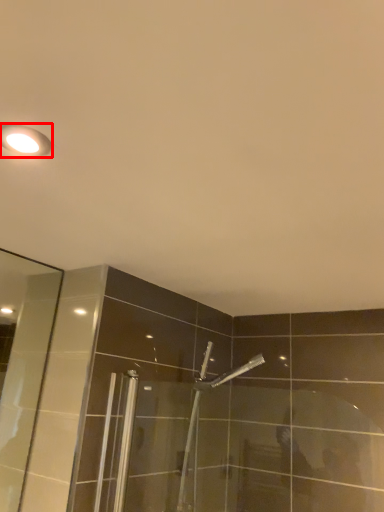
Question: Where is light fixture (annotated by the red box) located in relation to shower in the image?

Choices:
 (A) right
 (B) left

Answer: (B)